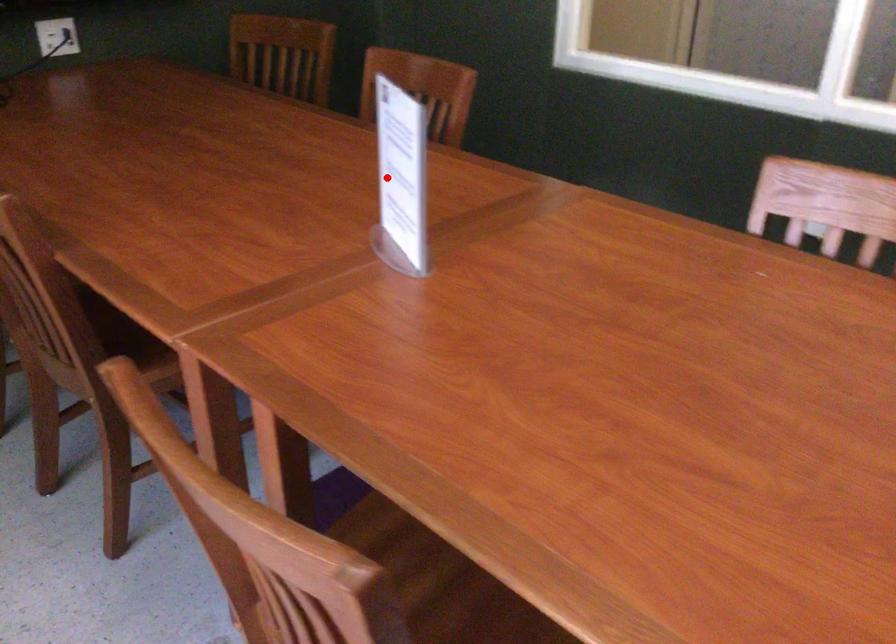
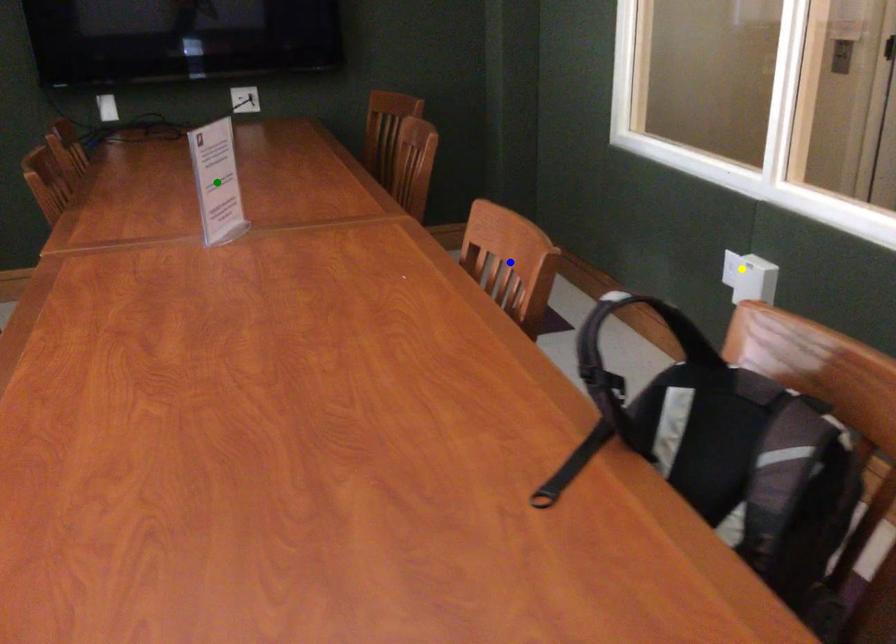
Question: I am providing you with two images of the same scene from different viewpoints. A red point is marked on the first image. You are given multiple points on the second image. In image 2, which mark is for the same physical point as the one in image 1?

Choices:
 (A) green point
 (B) blue point
 (C) yellow point

Answer: (A)